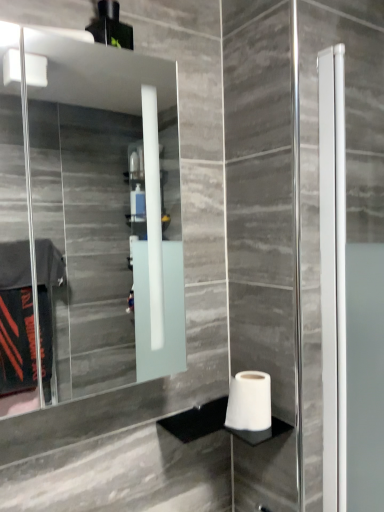
The image size is (384, 512). What do you see at coordinates (249, 402) in the screenshot?
I see `white matte toilet paper at lower right` at bounding box center [249, 402].

Identify the location of white matte toilet paper at lower right. (249, 402).

This screenshot has width=384, height=512. Describe the element at coordinates (96, 203) in the screenshot. I see `clear glass mirror at upper left` at that location.

What is the approximate height of clear glass mirror at upper left?

It is 24.69 inches.

At what (x,y) coordinates should I click in order to perform the action: click on clear glass mirror at upper left. Please return your answer as a coordinate pair (x, y). This screenshot has width=384, height=512. Looking at the image, I should click on (96, 203).

Where is `white matte toilet paper at lower right`? The height and width of the screenshot is (512, 384). white matte toilet paper at lower right is located at coordinates (249, 402).

Considering the relative positions of white matte toilet paper at lower right and clear glass mirror at upper left in the image provided, is white matte toilet paper at lower right to the right of clear glass mirror at upper left from the viewer's perspective?

Yes, white matte toilet paper at lower right is to the right of clear glass mirror at upper left.

Relative to clear glass mirror at upper left, is white matte toilet paper at lower right in front or behind?

In the image, white matte toilet paper at lower right appears behind clear glass mirror at upper left.

Is point (261, 397) positioned before point (159, 157)?

Yes, point (261, 397) is in front of point (159, 157).

From the image's perspective, is white matte toilet paper at lower right under clear glass mirror at upper left?

Indeed, from the image's perspective, white matte toilet paper at lower right is shown beneath clear glass mirror at upper left.

Looking at this image, from a real-world perspective, who is located higher, white matte toilet paper at lower right or clear glass mirror at upper left?

clear glass mirror at upper left is physically above.

Does white matte toilet paper at lower right have a greater width compared to clear glass mirror at upper left?

No, white matte toilet paper at lower right is not wider than clear glass mirror at upper left.

Does white matte toilet paper at lower right have a lesser height compared to clear glass mirror at upper left?

Indeed, white matte toilet paper at lower right has a lesser height compared to clear glass mirror at upper left.

Considering the sizes of objects white matte toilet paper at lower right and clear glass mirror at upper left in the image provided, who is smaller, white matte toilet paper at lower right or clear glass mirror at upper left?

white matte toilet paper at lower right is smaller.

Is white matte toilet paper at lower right inside the boundaries of clear glass mirror at upper left, or outside?

white matte toilet paper at lower right exists outside the volume of clear glass mirror at upper left.

Is white matte toilet paper at lower right next to clear glass mirror at upper left and touching it?

No, white matte toilet paper at lower right is not beside clear glass mirror at upper left.

Could you tell me if white matte toilet paper at lower right is turned towards clear glass mirror at upper left?

No, white matte toilet paper at lower right is not oriented towards clear glass mirror at upper left.

Can you tell me how much white matte toilet paper at lower right and clear glass mirror at upper left differ in facing direction?

There is a 0.00151-degree angle between the facing directions of white matte toilet paper at lower right and clear glass mirror at upper left.

Locate an element on the screen. toilet paper on the right side of clear glass mirror at upper left is located at coordinates (249, 402).

Is clear glass mirror at upper left to the right of white matte toilet paper at lower right from the viewer's perspective?

In fact, clear glass mirror at upper left is to the left of white matte toilet paper at lower right.

Considering the relative positions of clear glass mirror at upper left and white matte toilet paper at lower right in the image provided, is clear glass mirror at upper left behind white matte toilet paper at lower right?

No, clear glass mirror at upper left is closer to the viewer.

Considering the points (169, 198) and (239, 404), which point is behind, point (169, 198) or point (239, 404)?

The point (169, 198) is farther from the camera.

Consider the image. From the image's perspective, is clear glass mirror at upper left above or below white matte toilet paper at lower right?

clear glass mirror at upper left is above white matte toilet paper at lower right.

From a real-world perspective, does clear glass mirror at upper left sit lower than white matte toilet paper at lower right?

No, from a real-world perspective, clear glass mirror at upper left is not beneath white matte toilet paper at lower right.

Can you confirm if clear glass mirror at upper left is thinner than white matte toilet paper at lower right?

No.

Who is taller, clear glass mirror at upper left or white matte toilet paper at lower right?

clear glass mirror at upper left is taller.

Is clear glass mirror at upper left smaller than white matte toilet paper at lower right?

No.

Would you say clear glass mirror at upper left is inside or outside white matte toilet paper at lower right?

clear glass mirror at upper left is not inside white matte toilet paper at lower right, it's outside.

Is clear glass mirror at upper left with white matte toilet paper at lower right?

No, clear glass mirror at upper left is not with white matte toilet paper at lower right.

Is clear glass mirror at upper left aimed at white matte toilet paper at lower right?

No, clear glass mirror at upper left does not turn towards white matte toilet paper at lower right.

At what (x,y) coordinates should I click in order to perform the action: click on toilet paper that is on the right side of clear glass mirror at upper left. Please return your answer as a coordinate pair (x, y). Image resolution: width=384 pixels, height=512 pixels. Looking at the image, I should click on coord(249,402).

Find the location of a particular element. The width and height of the screenshot is (384, 512). mirror above the white matte toilet paper at lower right (from the image's perspective) is located at coordinates pyautogui.click(x=96, y=203).

Image resolution: width=384 pixels, height=512 pixels. I want to click on toilet paper lying below the clear glass mirror at upper left (from the image's perspective), so click(x=249, y=402).